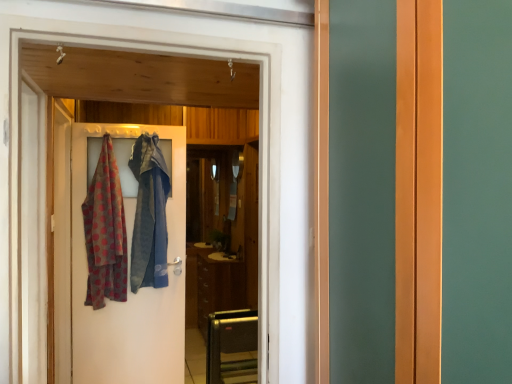
Question: Are wooden door at center and brown matte cabinet at center beside each other?

Choices:
 (A) no
 (B) yes

Answer: (A)

Question: Is wooden door at center aimed at brown matte cabinet at center?

Choices:
 (A) yes
 (B) no

Answer: (B)

Question: Can you confirm if wooden door at center is taller than brown matte cabinet at center?

Choices:
 (A) no
 (B) yes

Answer: (B)

Question: From the image's perspective, is wooden door at center located above brown matte cabinet at center?

Choices:
 (A) yes
 (B) no

Answer: (A)

Question: Would you say wooden door at center is outside brown matte cabinet at center?

Choices:
 (A) no
 (B) yes

Answer: (B)

Question: Is point (219, 339) positioned closer to the camera than point (118, 243)?

Choices:
 (A) farther
 (B) closer

Answer: (A)

Question: From their relative heights in the image, would you say metallic silver toaster at lower center is taller or shorter than polka dot fabric scarf at left?

Choices:
 (A) tall
 (B) short

Answer: (B)

Question: In the image, is metallic silver toaster at lower center on the left side or the right side of polka dot fabric scarf at left?

Choices:
 (A) left
 (B) right

Answer: (B)

Question: From a real-world perspective, is metallic silver toaster at lower center positioned above or below polka dot fabric scarf at left?

Choices:
 (A) below
 (B) above

Answer: (A)

Question: From the image's perspective, relative to brown matte cabinet at center, is metallic silver toaster at lower center above or below?

Choices:
 (A) below
 (B) above

Answer: (A)

Question: Is metallic silver toaster at lower center taller or shorter than brown matte cabinet at center?

Choices:
 (A) short
 (B) tall

Answer: (A)

Question: Looking at the image, does metallic silver toaster at lower center seem bigger or smaller compared to brown matte cabinet at center?

Choices:
 (A) small
 (B) big

Answer: (A)

Question: Is metallic silver toaster at lower center inside or outside of brown matte cabinet at center?

Choices:
 (A) inside
 (B) outside

Answer: (B)

Question: Is wooden door at center to the left or to the right of polka dot fabric scarf at left in the image?

Choices:
 (A) left
 (B) right

Answer: (B)

Question: In the image, is wooden door at center positioned in front of or behind polka dot fabric scarf at left?

Choices:
 (A) behind
 (B) front

Answer: (B)